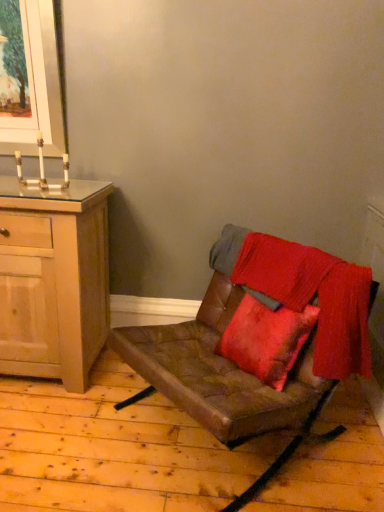
Question: Considering the relative positions of brown leather chair at center and light wood cabinet at left in the image provided, is brown leather chair at center behind light wood cabinet at left?

Choices:
 (A) yes
 (B) no

Answer: (B)

Question: Is light wood cabinet at left at the back of brown leather chair at center?

Choices:
 (A) no
 (B) yes

Answer: (A)

Question: Is brown leather chair at center at the right side of light wood cabinet at left?

Choices:
 (A) yes
 (B) no

Answer: (A)

Question: Is brown leather chair at center aimed at light wood cabinet at left?

Choices:
 (A) yes
 (B) no

Answer: (B)

Question: Is brown leather chair at center thinner than light wood cabinet at left?

Choices:
 (A) yes
 (B) no

Answer: (B)

Question: From the image's perspective, would you say brown leather chair at center is positioned over light wood cabinet at left?

Choices:
 (A) no
 (B) yes

Answer: (A)

Question: From a real-world perspective, does light wood cabinet at left sit lower than brown leather chair at center?

Choices:
 (A) yes
 (B) no

Answer: (B)

Question: Is light wood cabinet at left not inside brown leather chair at center?

Choices:
 (A) yes
 (B) no

Answer: (A)

Question: Does light wood cabinet at left have a smaller size compared to brown leather chair at center?

Choices:
 (A) no
 (B) yes

Answer: (B)

Question: Considering the relative positions of light wood cabinet at left and brown leather chair at center in the image provided, is light wood cabinet at left to the right of brown leather chair at center from the viewer's perspective?

Choices:
 (A) no
 (B) yes

Answer: (A)

Question: Is light wood cabinet at left facing away from brown leather chair at center?

Choices:
 (A) yes
 (B) no

Answer: (B)

Question: Is light wood cabinet at left not close to brown leather chair at center?

Choices:
 (A) no
 (B) yes

Answer: (A)

Question: Would you say brown leather chair at center is to the left or to the right of light wood cabinet at left in the picture?

Choices:
 (A) right
 (B) left

Answer: (A)